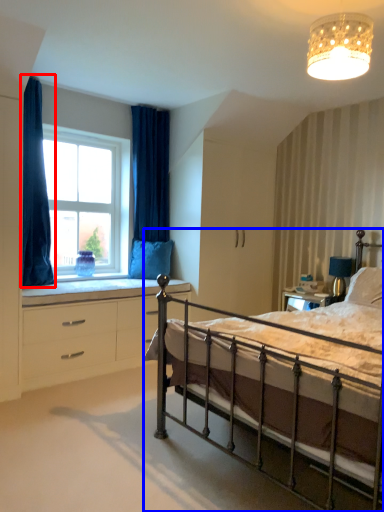
Question: Which of the following is the farthest to the observer, curtain (highlighted by a red box) or bed (highlighted by a blue box)?

Choices:
 (A) curtain
 (B) bed

Answer: (A)